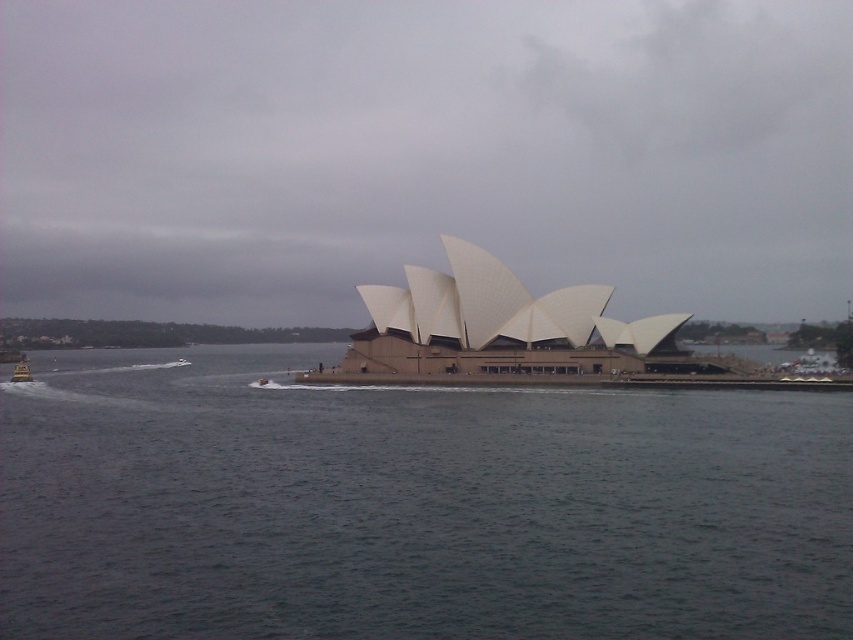
You are a photographer planning to capture a wide shot of the beige concrete opera house at center and the metallic silver boat at lower left. Considering their sizes, which object should you focus on first to ensure it is fully in frame?

The beige concrete opera house at center is much taller than the metallic silver boat at lower left, so you should focus on positioning the beige concrete opera house at center first to ensure it fits within the frame, as its larger size requires more attention to framing.

You are a photographer planning to capture the Sydney Opera House from a drone. You notice the gray water at center and the beige concrete opera house at center in your frame. Based on their sizes in the image, which one appears larger?

The gray water at center might be wider than beige concrete opera house at center, so the gray water at center could appear larger in the image.

You are a tourist standing at the point with coordinates (496,330). Based on the scene, what iconic landmark are you directly facing?

The point at coordinates (496,330) corresponds to the beige concrete opera house at center, so you are directly facing the Sydney Opera House.